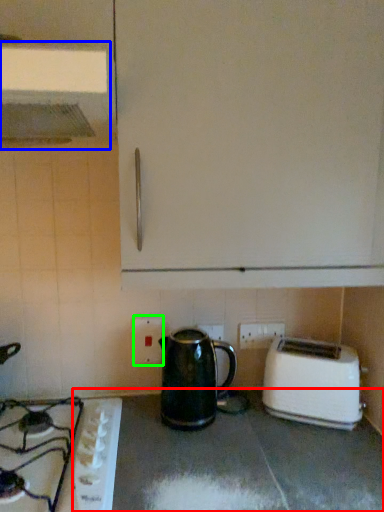
Question: Which is farther away from counter top (highlighted by a red box)? exhaust hood (highlighted by a blue box) or electric outlet (highlighted by a green box)?

Choices:
 (A) exhaust hood
 (B) electric outlet

Answer: (A)